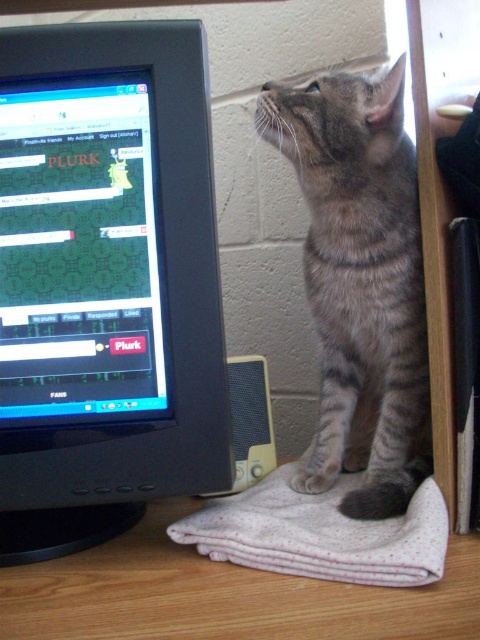
Looking at this image, which is more to the right, black plastic monitor at left or gray striped cat at upper right?

From the viewer's perspective, gray striped cat at upper right appears more on the right side.

Which of these two, black plastic monitor at left or gray striped cat at upper right, stands shorter?

gray striped cat at upper right is shorter.

Does point (165, 378) come behind point (391, 236)?

No, (165, 378) is in front of (391, 236).

Locate an element on the screen. The image size is (480, 640). black plastic monitor at left is located at coordinates (106, 282).

Is matte black monitor at center wider than white textured cloth at lower center?

In fact, matte black monitor at center might be narrower than white textured cloth at lower center.

Does point (8, 380) come behind point (414, 538)?

Yes, it is behind point (414, 538).

Between point (113, 406) and point (202, 522), which one is positioned in front?

Point (113, 406) is more forward.

Identify the location of matte black monitor at center. The image size is (480, 640). (79, 250).

Which is more to the right, gray striped cat at upper right or white textured cloth at lower center?

gray striped cat at upper right is more to the right.

Which is behind, point (343, 243) or point (337, 572)?

The point (343, 243) is behind.

Is point (357, 454) positioned after point (408, 545)?

Yes.

Where is `gray striped cat at upper right`? The width and height of the screenshot is (480, 640). gray striped cat at upper right is located at coordinates 360,282.